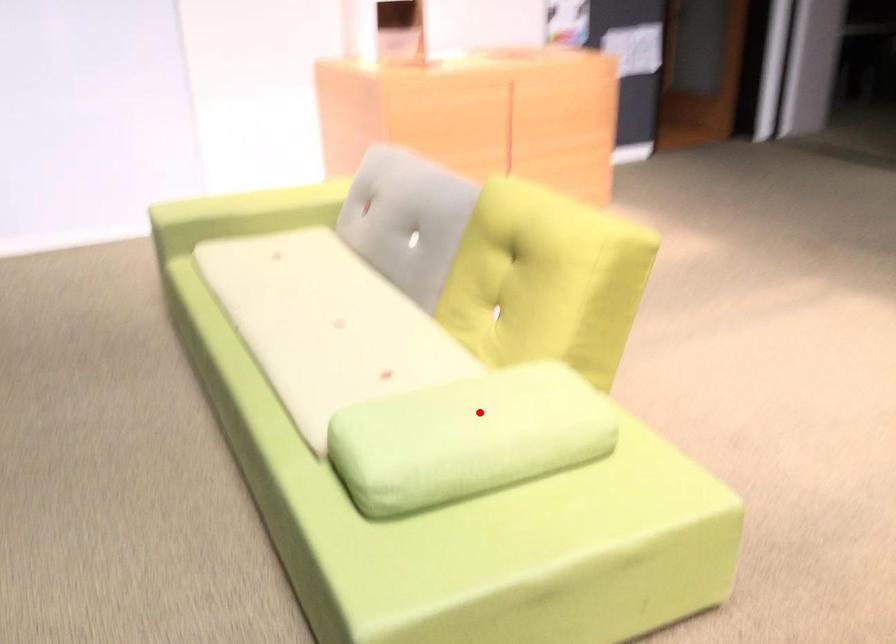
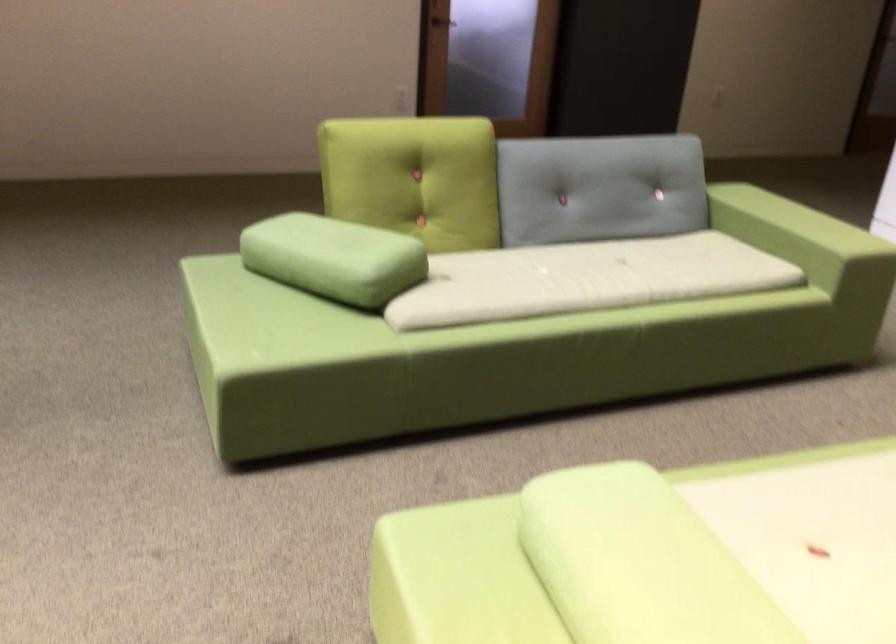
Find the pixel in the second image that matches the highlighted location in the first image.

(639, 563)